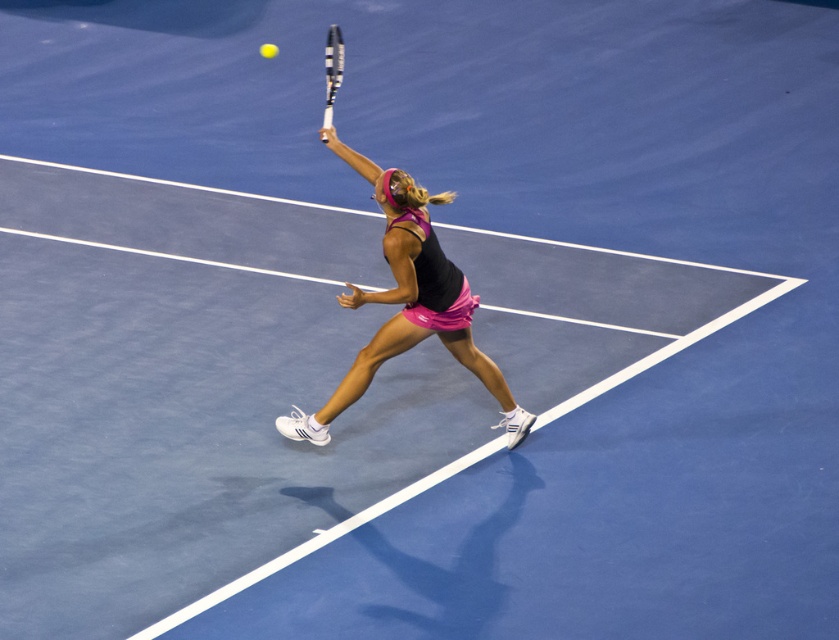
Question: Is pink fabric tennis skirt at center closer to camera compared to white textured tennis racket at upper center?

Choices:
 (A) yes
 (B) no

Answer: (A)

Question: Which point appears closest to the camera in this image?

Choices:
 (A) pyautogui.click(x=504, y=422)
 (B) pyautogui.click(x=336, y=67)

Answer: (B)

Question: Does pink fabric tennis skirt at center have a larger size compared to white textured tennis racket at upper center?

Choices:
 (A) no
 (B) yes

Answer: (B)

Question: Is pink fabric tennis skirt at center further to camera compared to white textured tennis racket at upper center?

Choices:
 (A) no
 (B) yes

Answer: (A)